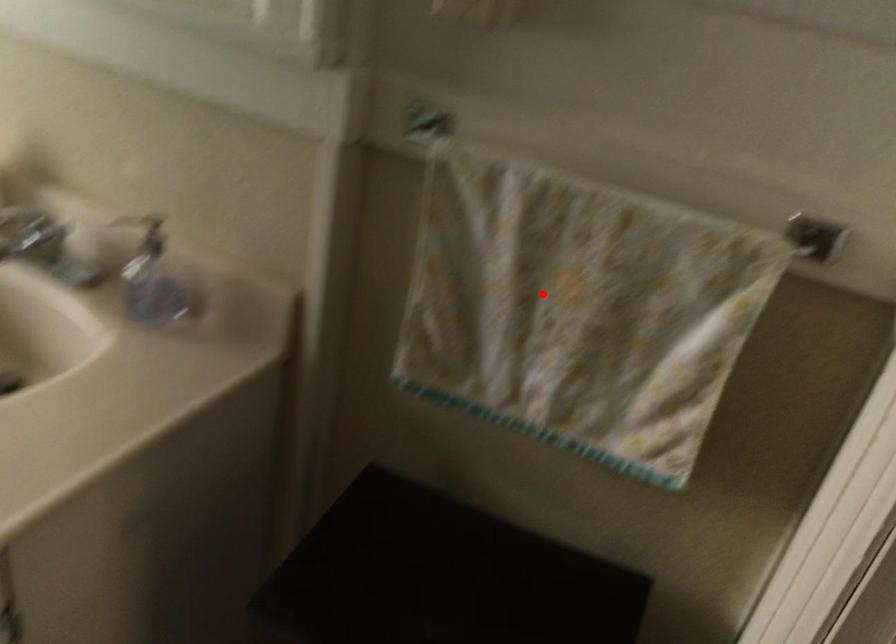
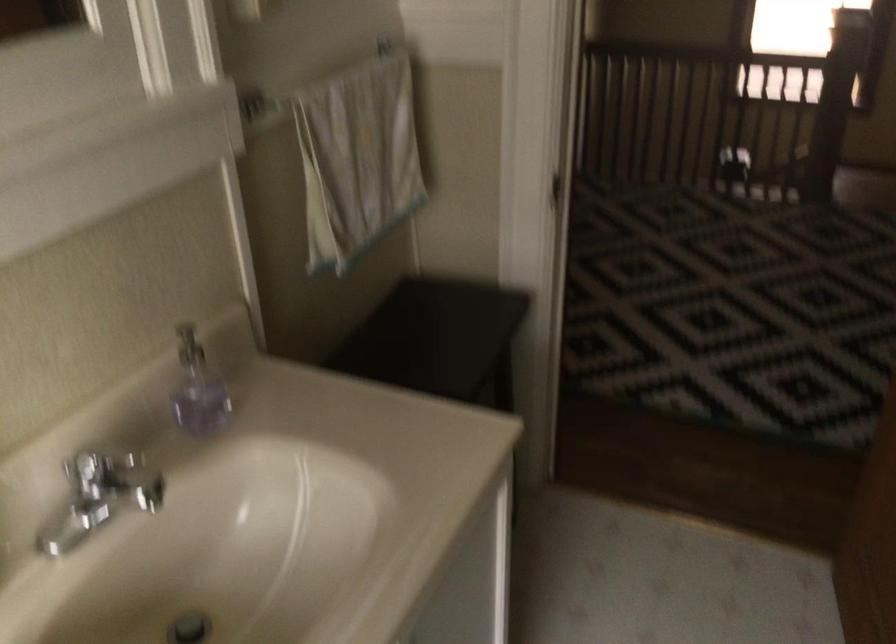
Locate, in the second image, the point that corresponds to the highlighted location in the first image.

(357, 158)